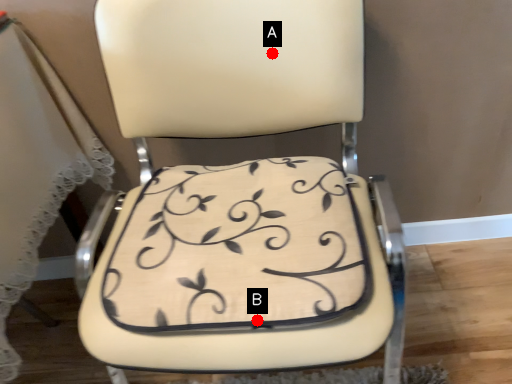
Question: Two points are circled on the image, labeled by A and B beside each circle. Which of the following is the closest to the observer?

Choices:
 (A) A is closer
 (B) B is closer

Answer: (B)